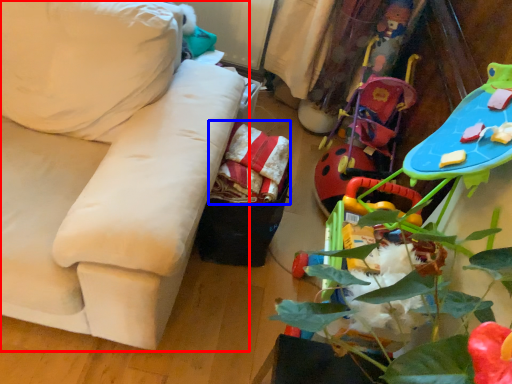
Question: Which object is further to the camera taking this photo, studio couch (highlighted by a red box) or material (highlighted by a blue box)?

Choices:
 (A) studio couch
 (B) material

Answer: (B)